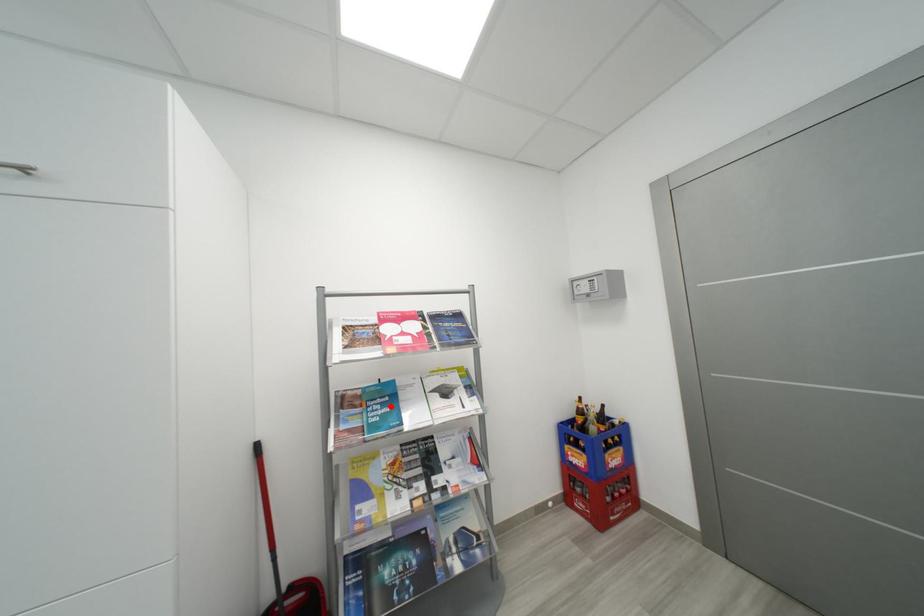
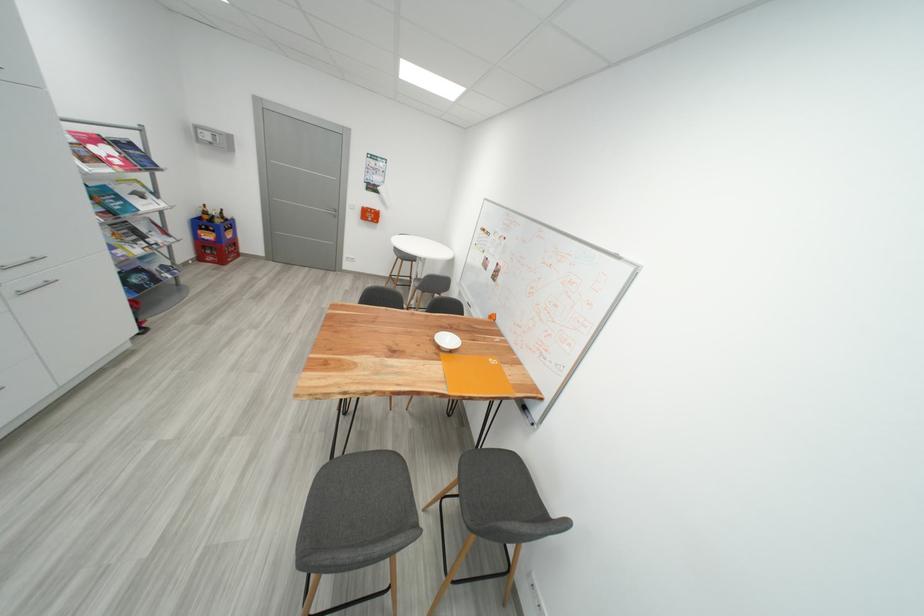
Question: I am providing you with two images of the same scene from different viewpoints. In image1, a red point is highlighted. Considering the same 3D point in image2, which of the following is correct?

Choices:
 (A) It is closer
 (B) It is farther

Answer: (B)